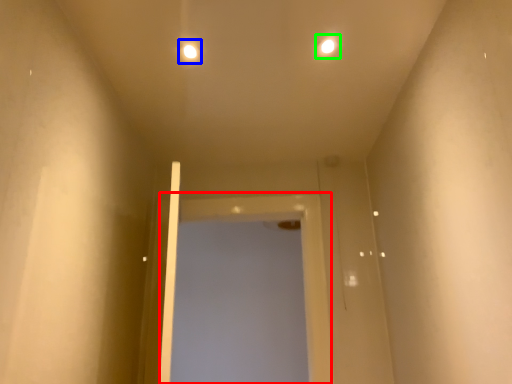
Question: Which object is the farthest from screen door (highlighted by a red box)? Choose among these: light (highlighted by a blue box) or light (highlighted by a green box).

Choices:
 (A) light
 (B) light

Answer: (B)